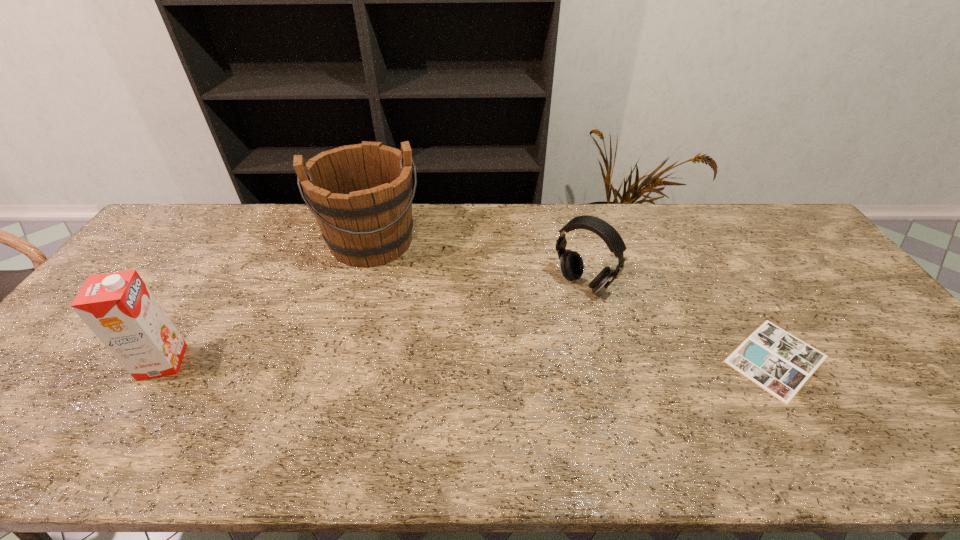
The height and width of the screenshot is (540, 960). In the image, there is a desktop. Identify the location of free space at the near right corner. (946, 396).

Where is `free area in between the second object from left to right and the carton`? The height and width of the screenshot is (540, 960). free area in between the second object from left to right and the carton is located at coordinates (268, 302).

At what (x,y) coordinates should I click in order to perform the action: click on free space between the book and the second object from left to right. Please return your answer as a coordinate pair (x, y). This screenshot has height=540, width=960. Looking at the image, I should click on (574, 300).

Where is `free space between the wine bucket and the leftmost object`? free space between the wine bucket and the leftmost object is located at coordinates coord(268,302).

Locate an element on the screen. The height and width of the screenshot is (540, 960). vacant point located between the leftmost object and the shortest object is located at coordinates (469, 361).

Locate an element on the screen. The image size is (960, 540). vacant area that lies between the rightmost object and the leftmost object is located at coordinates (469, 361).

The width and height of the screenshot is (960, 540). Find the location of `vacant space that's between the carton and the third object from left to right`. vacant space that's between the carton and the third object from left to right is located at coordinates (372, 323).

Find the location of a particular element. free point between the leftmost object and the second object from left to right is located at coordinates (268, 302).

Where is `empty space that is in between the rightmost object and the earphone`? The height and width of the screenshot is (540, 960). empty space that is in between the rightmost object and the earphone is located at coordinates (680, 321).

Find the location of `empty space that is in between the wine bucket and the leftmost object`. empty space that is in between the wine bucket and the leftmost object is located at coordinates (268, 302).